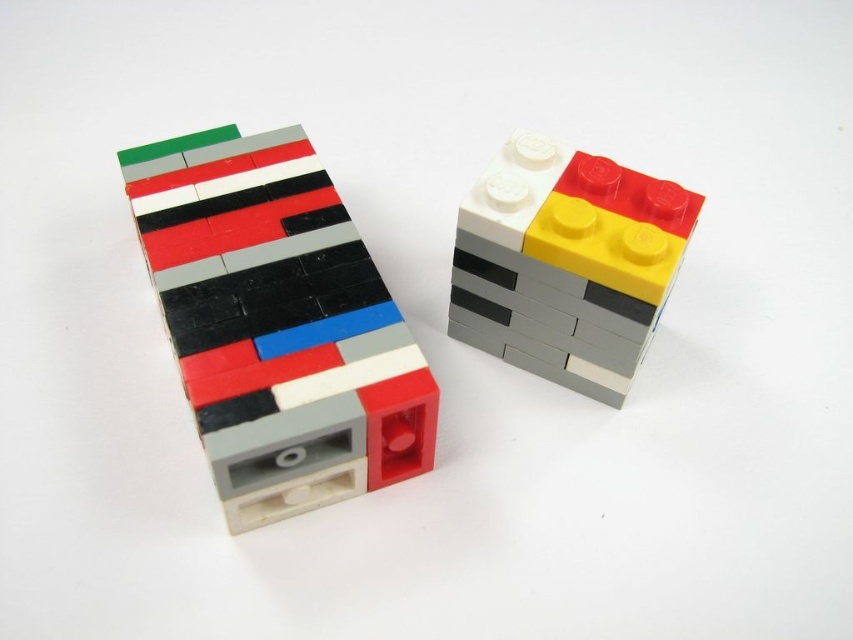
You are looking at the two LEGO stacks from the front. There are two points marked in the image. One is at point (x=239, y=320) and the other at point (x=645, y=316). Which point is closer to you?

Point (x=239, y=320) is closer to the viewer than point (x=645, y=316).

You are trying to fit the matte plastic brick at upper right into a space that can only accommodate items narrower than the matte plastic bricks at left. Based on the scene, will the brick fit?

The matte plastic bricks at left are wider than the matte plastic brick at upper right, so the brick at upper right will fit into the space since it is narrower.